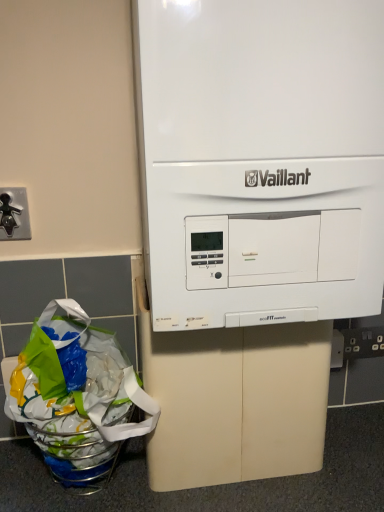
Question: Which is correct: white plastic electric outlet at lower right is inside black metal faucet at left, or outside of it?

Choices:
 (A) inside
 (B) outside

Answer: (B)

Question: Considering the positions of white plastic electric outlet at lower right and black metal faucet at left in the image, is white plastic electric outlet at lower right wider or thinner than black metal faucet at left?

Choices:
 (A) thin
 (B) wide

Answer: (A)

Question: Considering the real-world distances, which object is closest to the white plastic electric outlet at lower right?

Choices:
 (A) black metal faucet at left
 (B) translucent plastic grocery bag at lower left
 (C) white matte vaillant boiler at center

Answer: (C)

Question: Which object is positioned farthest from the white plastic electric outlet at lower right?

Choices:
 (A) white matte vaillant boiler at center
 (B) black metal faucet at left
 (C) translucent plastic grocery bag at lower left

Answer: (B)